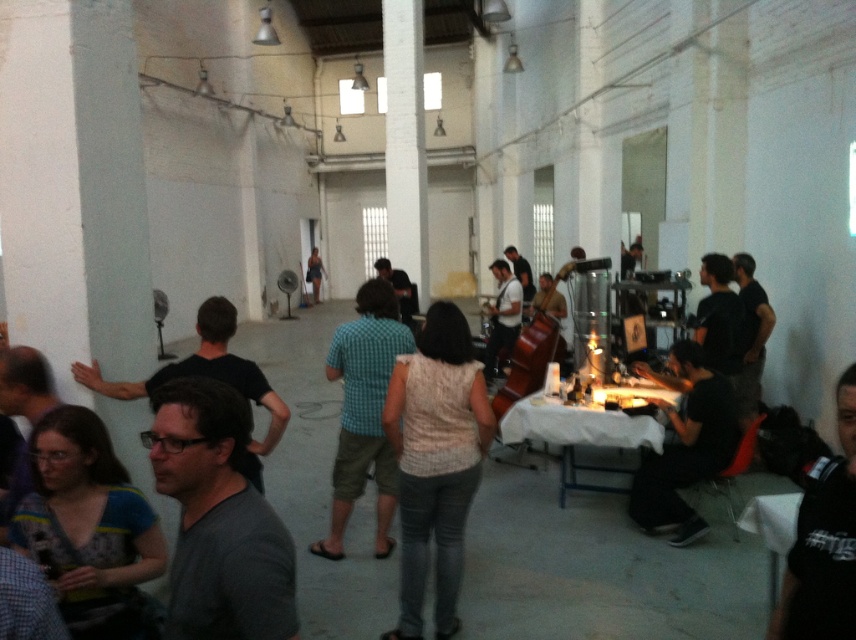
Question: Is the position of knitted beige sweater at center less distant than that of black matte shirt at lower right?

Choices:
 (A) yes
 (B) no

Answer: (A)

Question: Which of these objects is positioned farthest from the black matte shirt at lower right?

Choices:
 (A) black cotton t-shirt at lower right
 (B) checkered fabric shirt at center
 (C) knitted beige sweater at center

Answer: (A)

Question: Which point appears closest to the camera in this image?

Choices:
 (A) (337, 486)
 (B) (720, 396)
 (C) (428, 397)

Answer: (C)

Question: From the image, what is the correct spatial relationship of knitted beige sweater at center in relation to black matte shirt at lower right?

Choices:
 (A) above
 (B) below

Answer: (A)

Question: Where is knitted beige sweater at center located in relation to checkered fabric shirt at center in the image?

Choices:
 (A) below
 (B) above

Answer: (A)

Question: Which of the following is the farthest from the observer?

Choices:
 (A) black cotton t-shirt at lower right
 (B) knitted beige sweater at center
 (C) checkered fabric shirt at center

Answer: (C)